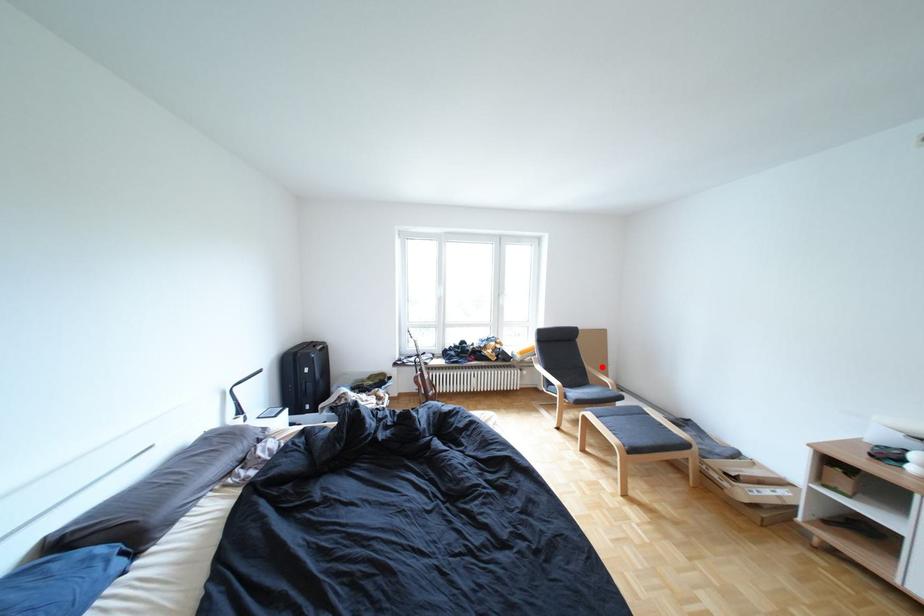
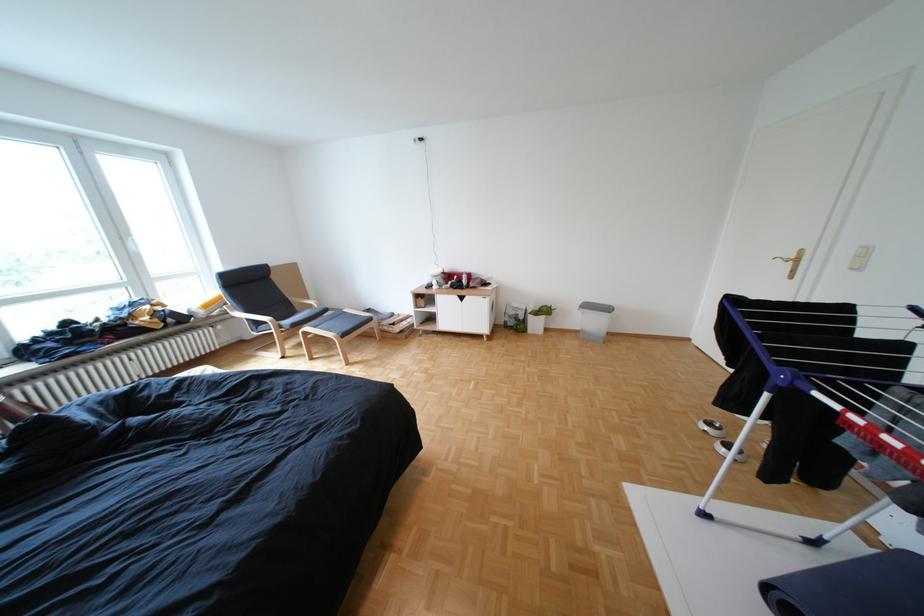
Question: A red point is marked in image1. In image2, is the corresponding 3D point closer to the camera or farther? Reply with the corresponding letter.

Choices:
 (A) The corresponding 3D point is closer.
 (B) The corresponding 3D point is farther.

Answer: (A)